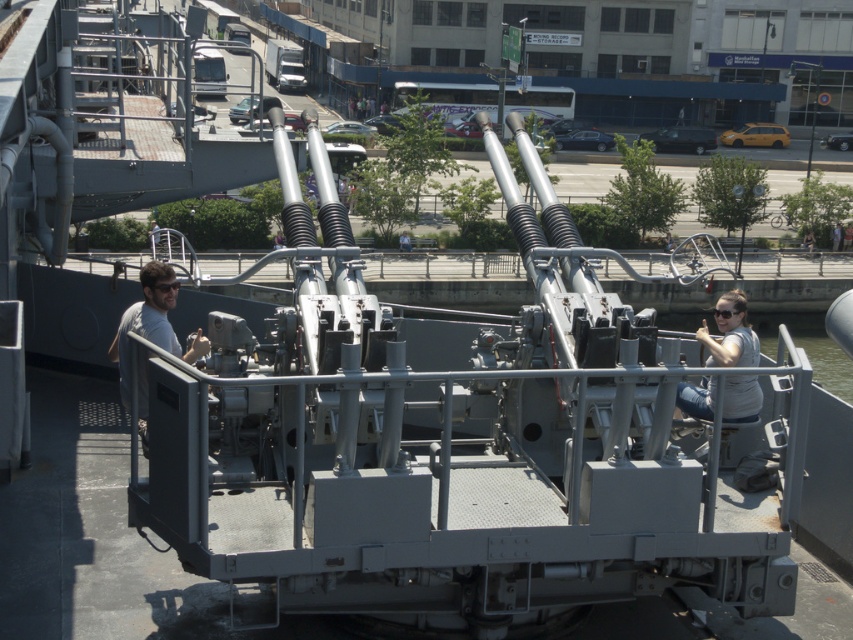
You are a technician assigned to inspect the gray metallic gun turret at center and the gray fabric shirt at center. Based on their sizes, which object requires more space to be handled safely?

The gray fabric shirt at center requires more space to be handled safely since it is larger than the gray metallic gun turret at center according to the description.

You are a maintenance technician assessing the clothing of two crew members on the naval gun. You need to ensure that their shirts are appropriate for the task. Which crew member has a wider shirt between the gray fabric shirt at center and the gray matte shirt at left?

The gray fabric shirt at center has a larger width than the gray matte shirt at left, so the crew member with the gray fabric shirt at center has a wider shirt.

You are a technician assigned to inspect the naval gun. You notice two crew members near the barrels. Which crew member, the gray fabric shirt at center or the gray matte shirt at left, is closer to you?

The gray fabric shirt at center is closer to you because it is positioned over the gray matte shirt at left.